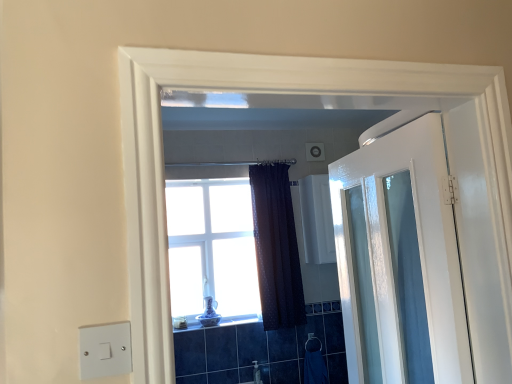
Question: From their relative heights in the image, would you say dark textured curtain at center is taller or shorter than clear glass window at center?

Choices:
 (A) short
 (B) tall

Answer: (B)

Question: From the image's perspective, relative to clear glass window at center, is dark textured curtain at center above or below?

Choices:
 (A) below
 (B) above

Answer: (A)

Question: Which is nearer to the clear glass window at center?

Choices:
 (A) dark textured curtain at center
 (B) white glass window at center
 (C) satin silver towel bar at lower center
 (D) white glossy medicine cabinet at upper center
 (E) blue fabric towel at lower right

Answer: (D)

Question: Based on their relative distances, which object is farther from the white plastic light switch at lower left?

Choices:
 (A) dark textured curtain at center
 (B) clear glass window at center
 (C) white glossy door at right
 (D) satin silver towel bar at lower center
 (E) white glass window at center

Answer: (D)